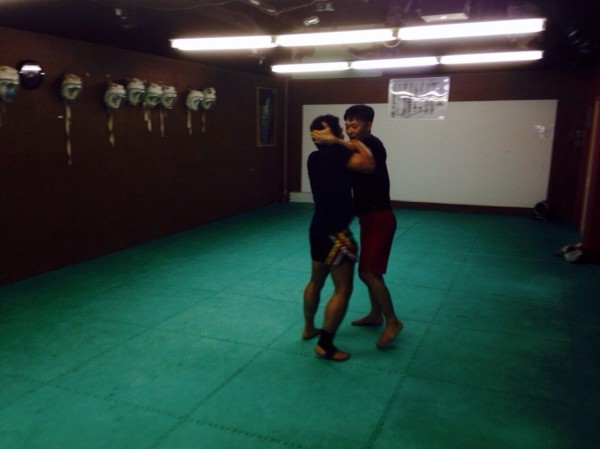
Locate an element on the screen. Image resolution: width=600 pixels, height=449 pixels. lights is located at coordinates (312, 37), (312, 62), (255, 43), (387, 62), (457, 30), (470, 59).